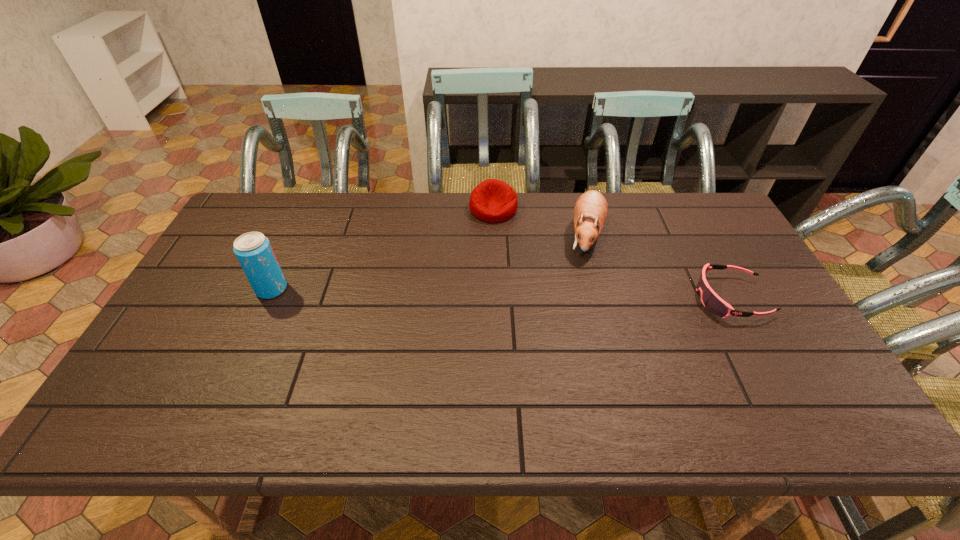
At what (x,y) coordinates should I click in order to perform the action: click on vacant spot on the desktop that is between the leftmost object and the goggles and is positioned at the face of the second tallest object. Please return your answer as a coordinate pair (x, y). This screenshot has width=960, height=540. Looking at the image, I should click on (563, 295).

Find the location of a particular element. This screenshot has height=540, width=960. vacant space on the desktop that is between the leftmost object and the rightmost object and is positioned on the seat area of the beanbag is located at coordinates (519, 294).